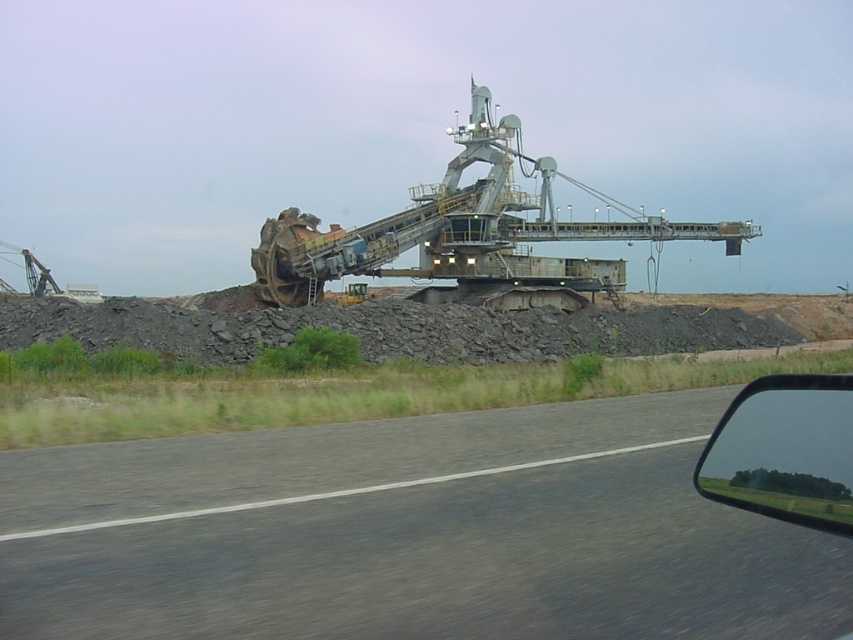
Is gray asphalt road at center to the left of rusty metal bucket at center from the viewer's perspective?

Yes, gray asphalt road at center is to the left of rusty metal bucket at center.

Where is `gray asphalt road at center`? Image resolution: width=853 pixels, height=640 pixels. gray asphalt road at center is located at coordinates pos(410,532).

Does gray asphalt road at center appear over transparent glass car window at lower right?

No.

Where is `gray asphalt road at center`? gray asphalt road at center is located at coordinates (410, 532).

Does rusty metal bucket at center appear on the left side of transparent glass car window at lower right?

In fact, rusty metal bucket at center is to the right of transparent glass car window at lower right.

Who is positioned more to the right, rusty metal bucket at center or transparent glass car window at lower right?

Positioned to the right is rusty metal bucket at center.

Is point (604, 275) closer to viewer compared to point (807, 400)?

No, it is behind (807, 400).

Locate an element on the screen. The height and width of the screenshot is (640, 853). rusty metal bucket at center is located at coordinates (466, 227).